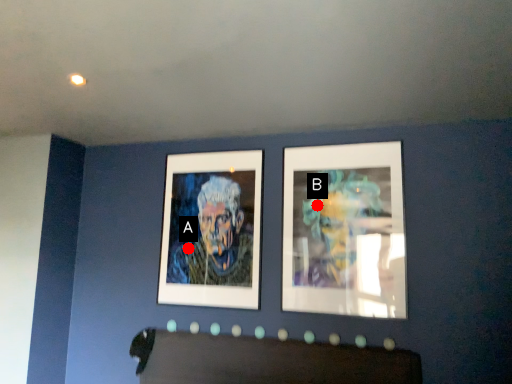
Question: Two points are circled on the image, labeled by A and B beside each circle. Which point is closer to the camera?

Choices:
 (A) A is closer
 (B) B is closer

Answer: (B)